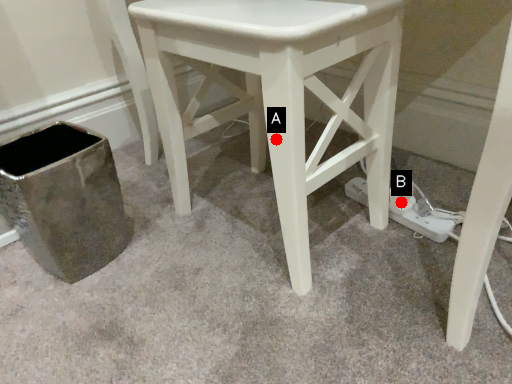
Question: Two points are circled on the image, labeled by A and B beside each circle. Which point is farther to the camera?

Choices:
 (A) A is further
 (B) B is further

Answer: (B)